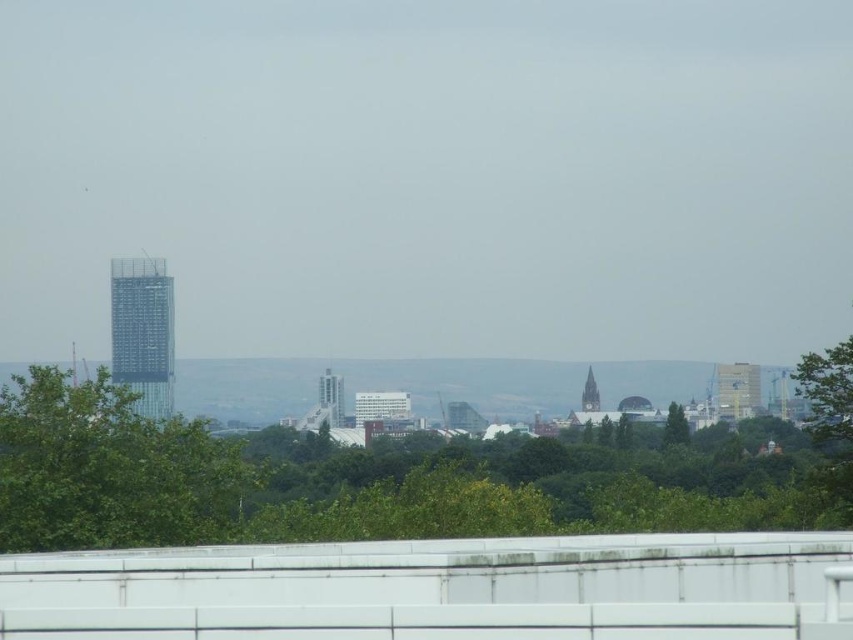
Question: Which object is closer to the camera taking this photo?

Choices:
 (A) green leafy tree at center
 (B) green leafy tree at left
 (C) green leafy tree at right
 (D) green leafy tree at lower center

Answer: (B)

Question: Which of the following is the closest to the observer?

Choices:
 (A) green leafy tree at left
 (B) green leafy tree at lower center
 (C) green leafy tree at right

Answer: (A)

Question: Can you confirm if green leafy tree at right is positioned to the right of green leafy tree at center?

Choices:
 (A) no
 (B) yes

Answer: (B)

Question: Can you confirm if green leafy tree at lower center is positioned to the left of green leafy tree at center?

Choices:
 (A) yes
 (B) no

Answer: (A)

Question: Which object is closer to the camera taking this photo?

Choices:
 (A) green leafy tree at right
 (B) green leafy tree at center
 (C) green leafy tree at lower center
 (D) green leafy tree at left

Answer: (D)

Question: Where is green leafy tree at left located in relation to green leafy tree at right in the image?

Choices:
 (A) above
 (B) below

Answer: (B)